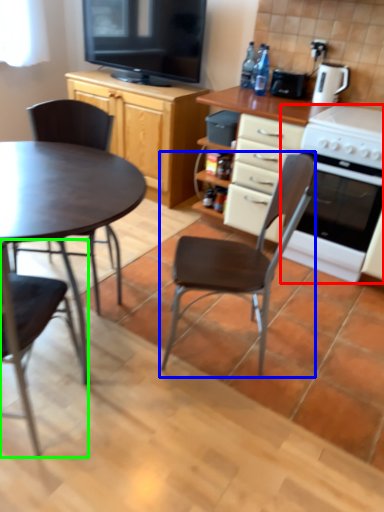
Question: Based on their relative distances, which object is farther from oven (highlighted by a red box)? Choose from chair (highlighted by a blue box) and chair (highlighted by a green box).

Choices:
 (A) chair
 (B) chair

Answer: (B)